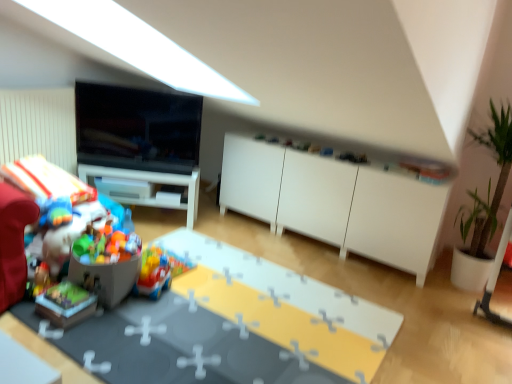
Where is `free space in front of translucent plastic toy car at center, marked as the 4th toy in a left-to-right arrangement`? The width and height of the screenshot is (512, 384). free space in front of translucent plastic toy car at center, marked as the 4th toy in a left-to-right arrangement is located at coordinates (146, 302).